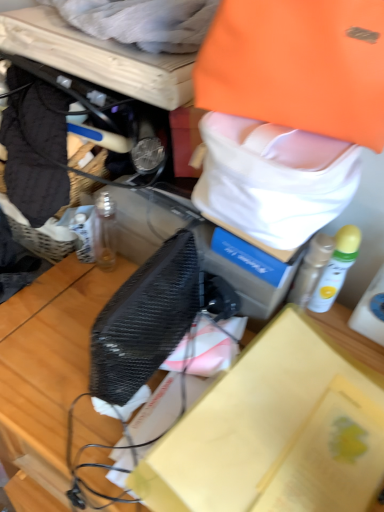
This screenshot has width=384, height=512. What do you see at coordinates (250, 420) in the screenshot?
I see `black mesh box at center` at bounding box center [250, 420].

The height and width of the screenshot is (512, 384). What do you see at coordinates (298, 66) in the screenshot?
I see `orange fabric bag at upper center, which appears as the second clothing when viewed from the top` at bounding box center [298, 66].

Find the location of a particular element. The image size is (384, 512). white matte bottle at upper right, which ranks as the 1th bottle in left-to-right order is located at coordinates point(311,269).

Where is `white matte spray can at right, the 1th bottle in the right-to-left sequence`? This screenshot has width=384, height=512. white matte spray can at right, the 1th bottle in the right-to-left sequence is located at coordinates (336, 268).

Identify the location of black mesh box at center. (250, 420).

Is point (343, 241) closer or farther from the camera than point (162, 26)?

Point (343, 241) appears to be farther away from the viewer than point (162, 26).

Is white matte spray can at right, the 2th bottle when ordered from left to right, aimed at white cotton towel at upper center, placed as the second clothing when sorted from right to left?

No, white matte spray can at right, the 2th bottle when ordered from left to right, is not facing towards white cotton towel at upper center, placed as the second clothing when sorted from right to left.

Would you say white matte spray can at right, the 2th bottle when ordered from left to right, is a long distance from white cotton towel at upper center, which is counted as the 2th clothing, starting from the bottom?

No, white matte spray can at right, the 2th bottle when ordered from left to right, is not far from white cotton towel at upper center, which is counted as the 2th clothing, starting from the bottom.

Between white matte spray can at right, the 1th bottle in the right-to-left sequence, and white cotton towel at upper center, placed as the 1th clothing when sorted from top to bottom, which one appears on the right side from the viewer's perspective?

Positioned to the right is white matte spray can at right, the 1th bottle in the right-to-left sequence.

Considering the relative positions of white cotton towel at upper center, which ranks as the 1th clothing in left-to-right order, and white matte bottle at upper right, which ranks as the 1th bottle in left-to-right order, in the image provided, is white cotton towel at upper center, which ranks as the 1th clothing in left-to-right order, to the left or to the right of white matte bottle at upper right, which ranks as the 1th bottle in left-to-right order,?

Clearly, white cotton towel at upper center, which ranks as the 1th clothing in left-to-right order, is on the left of white matte bottle at upper right, which ranks as the 1th bottle in left-to-right order, in the image.

Is white cotton towel at upper center, placed as the second clothing when sorted from right to left, next to white matte bottle at upper right, which ranks as the 1th bottle in left-to-right order?

No, white cotton towel at upper center, placed as the second clothing when sorted from right to left, is not making contact with white matte bottle at upper right, which ranks as the 1th bottle in left-to-right order.

From a real-world perspective, is white cotton towel at upper center, placed as the second clothing when sorted from right to left, located beneath white matte bottle at upper right, which ranks as the 1th bottle in left-to-right order?

Actually, white cotton towel at upper center, placed as the second clothing when sorted from right to left, is physically above white matte bottle at upper right, which ranks as the 1th bottle in left-to-right order, in the real world.

Starting from the white matte bottle at upper right, which ranks as the 1th bottle in left-to-right order, which clothing is the 2nd one to the left? Please provide its 2D coordinates.

[(142, 21)]

Is the surface of white cotton towel at upper center, placed as the 1th clothing when sorted from top to bottom, in direct contact with orange fabric bag at upper center, the first clothing viewed from the right?

No.

Is point (55, 3) closer or farther from the camera than point (252, 44)?

Point (55, 3) appears to be farther away from the viewer than point (252, 44).

Would you say white cotton towel at upper center, placed as the 1th clothing when sorted from top to bottom, is inside or outside orange fabric bag at upper center, the 1th clothing ordered from the bottom?

white cotton towel at upper center, placed as the 1th clothing when sorted from top to bottom, is spatially situated outside orange fabric bag at upper center, the 1th clothing ordered from the bottom.

Considering the relative positions of white cotton towel at upper center, placed as the second clothing when sorted from right to left, and orange fabric bag at upper center, the 1th clothing ordered from the bottom, in the image provided, is white cotton towel at upper center, placed as the second clothing when sorted from right to left, behind orange fabric bag at upper center, the 1th clothing ordered from the bottom,?

Yes, white cotton towel at upper center, placed as the second clothing when sorted from right to left, is behind orange fabric bag at upper center, the 1th clothing ordered from the bottom.

Does orange fabric bag at upper center, the 1th clothing ordered from the bottom, have a larger size compared to white cotton towel at upper center, placed as the second clothing when sorted from right to left?

Yes, orange fabric bag at upper center, the 1th clothing ordered from the bottom, is bigger than white cotton towel at upper center, placed as the second clothing when sorted from right to left.

Considering the sizes of objects orange fabric bag at upper center, the first clothing viewed from the right, and white cotton towel at upper center, which is counted as the 2th clothing, starting from the bottom, in the image provided, who is shorter, orange fabric bag at upper center, the first clothing viewed from the right, or white cotton towel at upper center, which is counted as the 2th clothing, starting from the bottom,?

With less height is white cotton towel at upper center, which is counted as the 2th clothing, starting from the bottom.

Can we say orange fabric bag at upper center, the 1th clothing ordered from the bottom, lies outside white cotton towel at upper center, placed as the 1th clothing when sorted from top to bottom?

Yes, orange fabric bag at upper center, the 1th clothing ordered from the bottom, is outside of white cotton towel at upper center, placed as the 1th clothing when sorted from top to bottom.

Is the depth of orange fabric bag at upper center, acting as the 2th clothing starting from the left, greater than that of white cotton towel at upper center, which is counted as the 2th clothing, starting from the bottom?

No, it is not.

Can you see white matte bottle at upper right, the second bottle when ordered from right to left, touching white cotton towel at upper center, which is counted as the 2th clothing, starting from the bottom?

No, white matte bottle at upper right, the second bottle when ordered from right to left, is not with white cotton towel at upper center, which is counted as the 2th clothing, starting from the bottom.

Is white matte bottle at upper right, the second bottle when ordered from right to left, positioned with its back to white cotton towel at upper center, which is counted as the 2th clothing, starting from the bottom?

No.

Is white cotton towel at upper center, which is counted as the 2th clothing, starting from the bottom, located within white matte bottle at upper right, the second bottle when ordered from right to left?

No, white cotton towel at upper center, which is counted as the 2th clothing, starting from the bottom, is not a part of white matte bottle at upper right, the second bottle when ordered from right to left.

What's the angular difference between white matte bottle at upper right, the second bottle when ordered from right to left, and white cotton towel at upper center, placed as the 1th clothing when sorted from top to bottom,'s facing directions?

5.69 degrees separate the facing orientations of white matte bottle at upper right, the second bottle when ordered from right to left, and white cotton towel at upper center, placed as the 1th clothing when sorted from top to bottom.

Is orange fabric tote bag at upper right wider than white cotton towel at upper center, which ranks as the 1th clothing in left-to-right order?

Indeed, orange fabric tote bag at upper right has a greater width compared to white cotton towel at upper center, which ranks as the 1th clothing in left-to-right order.

Is orange fabric tote bag at upper right touching white cotton towel at upper center, placed as the second clothing when sorted from right to left?

They are not placed beside each other.

Considering the relative positions of orange fabric tote bag at upper right and white cotton towel at upper center, which ranks as the 1th clothing in left-to-right order, in the image provided, is orange fabric tote bag at upper right to the left of white cotton towel at upper center, which ranks as the 1th clothing in left-to-right order, from the viewer's perspective?

No.

From the image's perspective, between orange fabric tote bag at upper right and white cotton towel at upper center, placed as the 1th clothing when sorted from top to bottom, which one is located above?

white cotton towel at upper center, placed as the 1th clothing when sorted from top to bottom, is shown above in the image.

Considering the relative sizes of orange fabric tote bag at upper right and white matte spray can at right, the 1th bottle in the right-to-left sequence, in the image provided, is orange fabric tote bag at upper right taller than white matte spray can at right, the 1th bottle in the right-to-left sequence,?

Incorrect, the height of orange fabric tote bag at upper right is not larger of that of white matte spray can at right, the 1th bottle in the right-to-left sequence.

Identify the location of bottle that is the 2nd object located behind the orange fabric tote bag at upper right. Image resolution: width=384 pixels, height=512 pixels. (336, 268).

From the image's perspective, is orange fabric tote bag at upper right on white matte spray can at right, the 1th bottle in the right-to-left sequence?

Correct, orange fabric tote bag at upper right appears higher than white matte spray can at right, the 1th bottle in the right-to-left sequence, in the image.

Is orange fabric tote bag at upper right oriented towards white matte spray can at right, the 2th bottle when ordered from left to right?

No, orange fabric tote bag at upper right is not aimed at white matte spray can at right, the 2th bottle when ordered from left to right.

The image size is (384, 512). In order to click on the 2nd bottle counting from the right of the white cotton towel at upper center, which ranks as the 1th clothing in left-to-right order in this screenshot , I will do `click(336, 268)`.

Image resolution: width=384 pixels, height=512 pixels. Identify the location of clothing that is the 2nd object above the white matte bottle at upper right, the second bottle when ordered from right to left (from a real-world perspective). (142, 21).

Estimate the real-world distances between objects in this image. Which object is further from orange fabric tote bag at upper right, white cotton towel at upper center, which ranks as the 1th clothing in left-to-right order, or white matte spray can at right, the 1th bottle in the right-to-left sequence?

white cotton towel at upper center, which ranks as the 1th clothing in left-to-right order.

Which object lies further to the anchor point white matte spray can at right, the 2th bottle when ordered from left to right, orange fabric tote bag at upper right or white matte bottle at upper right, which ranks as the 1th bottle in left-to-right order?

Based on the image, orange fabric tote bag at upper right appears to be further to white matte spray can at right, the 2th bottle when ordered from left to right.

Which object lies nearer to the anchor point orange fabric tote bag at upper right, white cotton towel at upper center, which ranks as the 1th clothing in left-to-right order, or white matte bottle at upper right, the second bottle when ordered from right to left?

The object closer to orange fabric tote bag at upper right is white matte bottle at upper right, the second bottle when ordered from right to left.

Considering their positions, is orange fabric bag at upper center, the first clothing viewed from the right, positioned further to black mesh box at center than orange fabric tote bag at upper right?

orange fabric bag at upper center, the first clothing viewed from the right, is further to black mesh box at center.

From the image, which object appears to be farther from black mesh box at center, white matte spray can at right, the 2th bottle when ordered from left to right, or orange fabric bag at upper center, the first clothing viewed from the right?

The object further to black mesh box at center is orange fabric bag at upper center, the first clothing viewed from the right.

Looking at the image, which one is located closer to white matte spray can at right, the 1th bottle in the right-to-left sequence, black mesh box at center or white cotton towel at upper center, which ranks as the 1th clothing in left-to-right order?

black mesh box at center lies closer to white matte spray can at right, the 1th bottle in the right-to-left sequence, than the other object.

Looking at the image, which one is located further to orange fabric bag at upper center, the 1th clothing ordered from the bottom, white matte spray can at right, the 1th bottle in the right-to-left sequence, or orange fabric tote bag at upper right?

white matte spray can at right, the 1th bottle in the right-to-left sequence, is positioned further to the anchor orange fabric bag at upper center, the 1th clothing ordered from the bottom.

From the picture: Considering their positions, is white matte bottle at upper right, which ranks as the 1th bottle in left-to-right order, positioned further to white matte spray can at right, the 1th bottle in the right-to-left sequence, than orange fabric tote bag at upper right?

orange fabric tote bag at upper right is positioned further to the anchor white matte spray can at right, the 1th bottle in the right-to-left sequence.

Find the location of `clothing between white cotton towel at upper center, placed as the 1th clothing when sorted from top to bottom, and white matte spray can at right, the 2th bottle when ordered from left to right, from top to bottom`. clothing between white cotton towel at upper center, placed as the 1th clothing when sorted from top to bottom, and white matte spray can at right, the 2th bottle when ordered from left to right, from top to bottom is located at coordinates (298, 66).

At what (x,y) coordinates should I click in order to perform the action: click on clothing between white cotton towel at upper center, which is counted as the 2th clothing, starting from the bottom, and black mesh box at center, in the vertical direction. Please return your answer as a coordinate pair (x, y). The width and height of the screenshot is (384, 512). Looking at the image, I should click on (298, 66).

Locate an element on the screen. Image resolution: width=384 pixels, height=512 pixels. tote bag between white cotton towel at upper center, which ranks as the 1th clothing in left-to-right order, and orange fabric bag at upper center, which appears as the second clothing when viewed from the top, from left to right is located at coordinates (273, 179).

Find the location of a particular element. bottle located between black mesh box at center and white matte spray can at right, the 2th bottle when ordered from left to right, in the depth direction is located at coordinates click(311, 269).